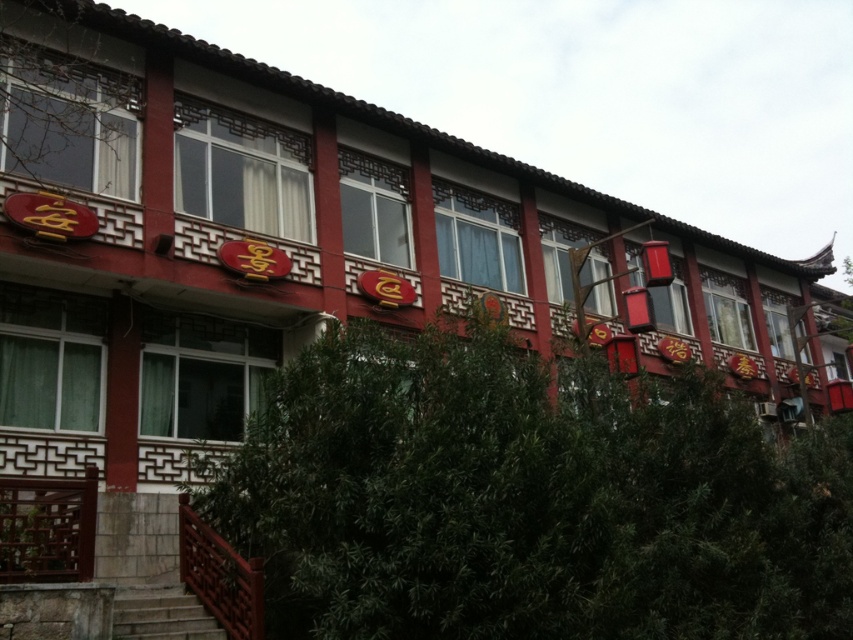
What do you see at coordinates (527, 499) in the screenshot? I see `green leafy tree at lower center` at bounding box center [527, 499].

Which is above, green leafy tree at lower center or wooden railing at lower left?

wooden railing at lower left

Does point (733, 429) come in front of point (254, 608)?

No, (733, 429) is further to viewer.

Where is `green leafy tree at lower center`? This screenshot has height=640, width=853. green leafy tree at lower center is located at coordinates (527, 499).